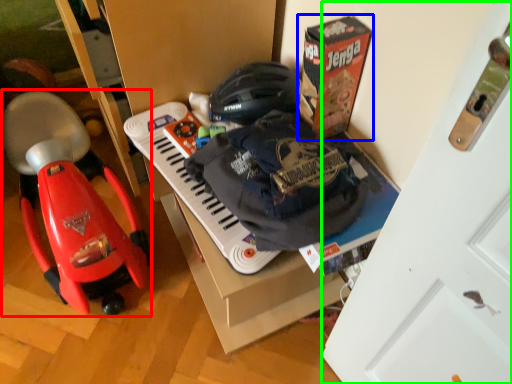
Question: Considering the real-world distances, which object is closest to baby carriage (highlighted by a red box)? box (highlighted by a blue box) or door (highlighted by a green box).

Choices:
 (A) box
 (B) door

Answer: (A)